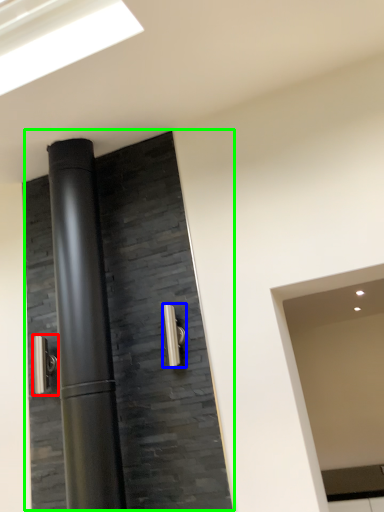
Question: Which object is positioned closest to door handle (highlighted by a red box)? Select from door handle (highlighted by a blue box) and door (highlighted by a green box).

Choices:
 (A) door handle
 (B) door

Answer: (B)